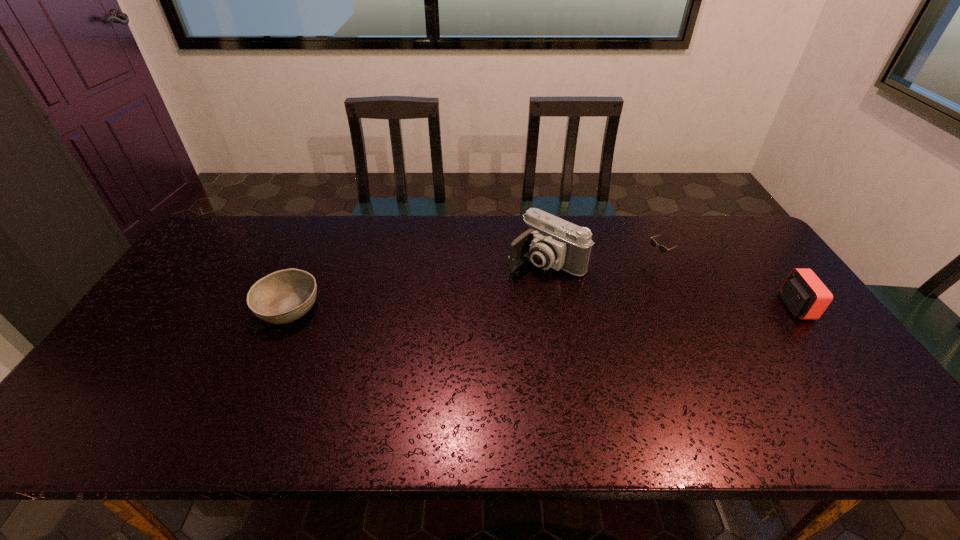
Where is `vacant area at the far right corner`? The height and width of the screenshot is (540, 960). vacant area at the far right corner is located at coordinates (729, 221).

Find the location of a particular element. The width and height of the screenshot is (960, 540). vacant area between the sunglasses and the leftmost object is located at coordinates (473, 285).

Identify the location of vacant space in between the camera and the sunglasses. This screenshot has width=960, height=540. (602, 261).

This screenshot has height=540, width=960. In order to click on vacant area that lies between the leftmost object and the second tallest object in this screenshot , I will do `click(542, 307)`.

You are a GUI agent. You are given a task and a screenshot of the screen. Output one action in this format:
    pyautogui.click(x=<x>, y=<y>)
    Task: Click on the unoccupied area between the alarm clock and the sunglasses
    The image size is (960, 540).
    Given the screenshot: What is the action you would take?
    pyautogui.click(x=727, y=283)

This screenshot has width=960, height=540. Identify the location of blank region between the camera and the second tallest object. (x=670, y=284).

Identify the location of unoccupied area between the sunglasses and the tallest object. (602, 261).

Where is `vacant space in between the third object from left to right and the third object from right to left`? vacant space in between the third object from left to right and the third object from right to left is located at coordinates (602, 261).

Find the location of a particular element. vacant space in between the sunglasses and the camera is located at coordinates (602, 261).

You are a GUI agent. You are given a task and a screenshot of the screen. Output one action in this format:
    pyautogui.click(x=<x>, y=<y>)
    Task: Click on the free space that is in between the third object from left to right and the camera
    The image size is (960, 540).
    Given the screenshot: What is the action you would take?
    pyautogui.click(x=602, y=261)